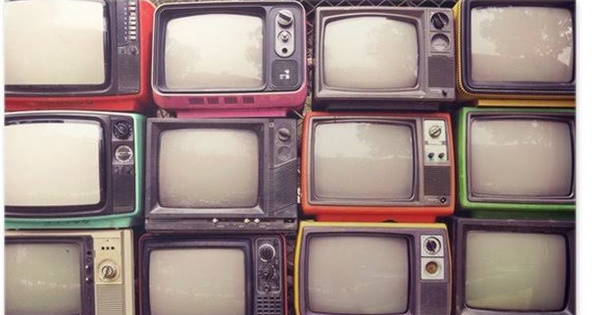
Identify the location of dials on the televisions. Image resolution: width=600 pixels, height=315 pixels. (123, 131), (123, 154), (105, 270), (268, 251), (265, 272), (432, 246), (435, 130), (443, 21), (285, 19), (287, 40).